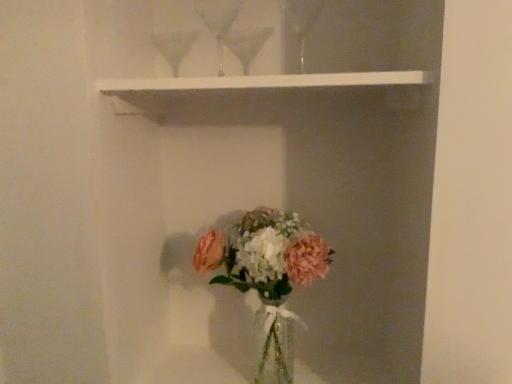
Question: Considering the relative positions of white matte shelf at upper center and translucent glass vase at lower center in the image provided, is white matte shelf at upper center in front of translucent glass vase at lower center?

Choices:
 (A) yes
 (B) no

Answer: (A)

Question: From a real-world perspective, is white matte shelf at upper center physically below translucent glass vase at lower center?

Choices:
 (A) yes
 (B) no

Answer: (B)

Question: Is white matte shelf at upper center at the left side of translucent glass vase at lower center?

Choices:
 (A) yes
 (B) no

Answer: (A)

Question: Does white matte shelf at upper center have a greater width compared to translucent glass vase at lower center?

Choices:
 (A) no
 (B) yes

Answer: (B)

Question: Is white matte shelf at upper center shorter than translucent glass vase at lower center?

Choices:
 (A) yes
 (B) no

Answer: (A)

Question: Could translucent glass vase at lower center be considered to be inside white matte shelf at upper center?

Choices:
 (A) no
 (B) yes

Answer: (A)

Question: Is translucent glass vase at lower center far from white matte shelf at upper center?

Choices:
 (A) yes
 (B) no

Answer: (B)

Question: Is translucent glass vase at lower center aimed at white matte shelf at upper center?

Choices:
 (A) no
 (B) yes

Answer: (A)

Question: Is translucent glass vase at lower center at the left side of white matte shelf at upper center?

Choices:
 (A) no
 (B) yes

Answer: (A)

Question: Considering the relative sizes of translucent glass vase at lower center and white matte shelf at upper center in the image provided, is translucent glass vase at lower center taller than white matte shelf at upper center?

Choices:
 (A) no
 (B) yes

Answer: (B)

Question: Is translucent glass vase at lower center completely or partially outside of white matte shelf at upper center?

Choices:
 (A) no
 (B) yes

Answer: (B)

Question: Is translucent glass vase at lower center further to the viewer compared to white matte shelf at upper center?

Choices:
 (A) no
 (B) yes

Answer: (B)

Question: Considering the positions of translucent glass vase at lower center and white matte shelf at upper center in the image, is translucent glass vase at lower center wider or thinner than white matte shelf at upper center?

Choices:
 (A) thin
 (B) wide

Answer: (A)